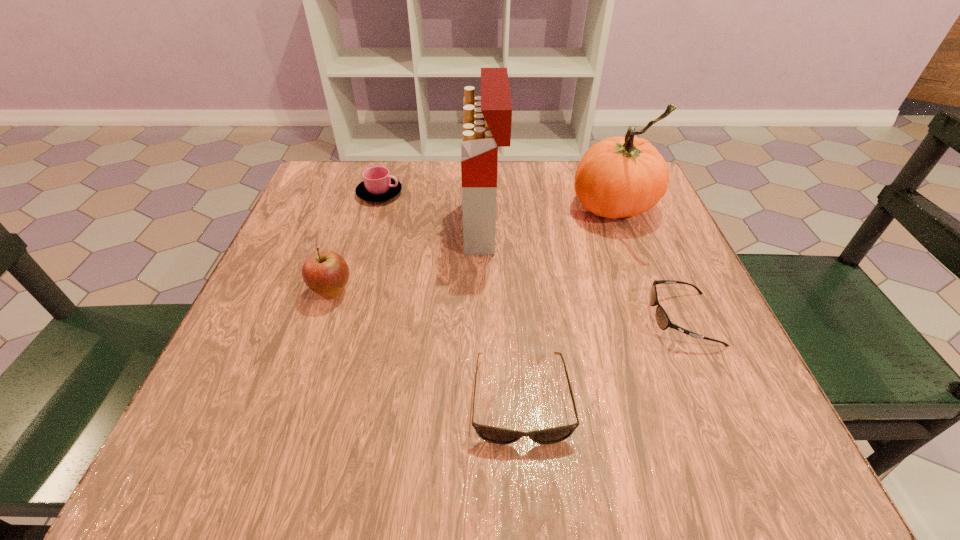
The height and width of the screenshot is (540, 960). What are the coordinates of `free region located 0.370m on the front of the pumpkin` in the screenshot? It's located at (683, 388).

Image resolution: width=960 pixels, height=540 pixels. I want to click on vacant space located 0.310m on the right of the apple, so click(518, 292).

Identify the location of vacant space located on the side with the handle of the cup. (456, 193).

I want to click on vacant space located 0.350m on the front-facing side of the farther sunglasses, so click(x=452, y=319).

I want to click on free spot located 0.060m on the front-facing side of the farther sunglasses, so click(616, 319).

At what (x,y) coordinates should I click in order to perform the action: click on blank space located on the front-facing side of the farther sunglasses. Please return your answer as a coordinate pair (x, y). Looking at the image, I should click on (481, 319).

I want to click on cigarette case that is at the far edge, so click(x=487, y=121).

I want to click on pumpkin located at the far edge, so click(x=618, y=177).

This screenshot has width=960, height=540. Identify the location of cup that is at the far edge. (378, 185).

Where is `object located in the near edge section of the desktop`? The width and height of the screenshot is (960, 540). object located in the near edge section of the desktop is located at coordinates click(491, 434).